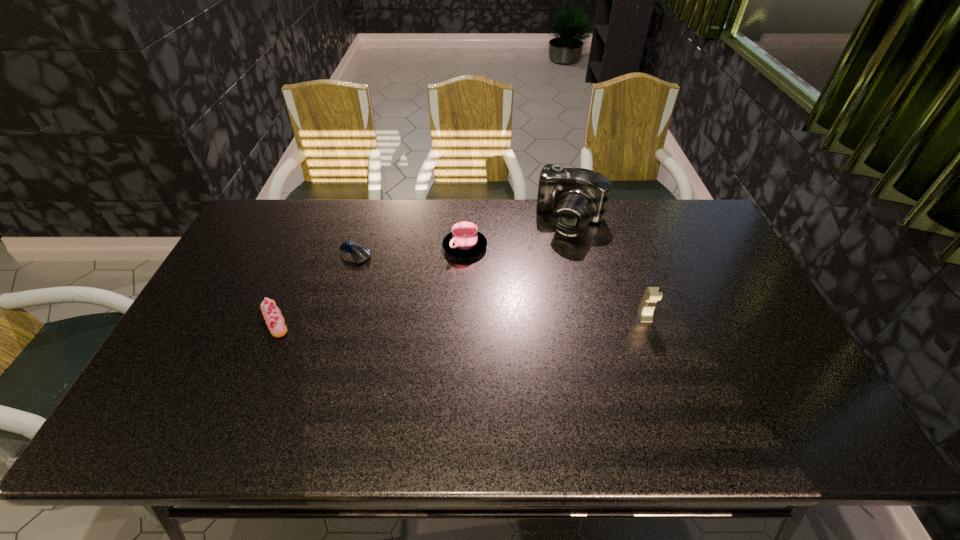
The image size is (960, 540). What are the coordinates of `the fourth tallest object` in the screenshot? It's located at (275, 321).

This screenshot has width=960, height=540. I want to click on eclair, so click(275, 321).

Where is `the rightmost object`? Image resolution: width=960 pixels, height=540 pixels. the rightmost object is located at coordinates (652, 294).

Locate an element on the screen. The image size is (960, 540). cup is located at coordinates (464, 241).

Identify the location of the third object from right to left. The width and height of the screenshot is (960, 540). (464, 241).

Identify the location of the fourth object from left to right. Image resolution: width=960 pixels, height=540 pixels. (577, 196).

Locate an element on the screen. the shortest object is located at coordinates (349, 251).

Identify the location of computer mouse. Image resolution: width=960 pixels, height=540 pixels. (349, 251).

At what (x,y) coordinates should I click in order to perform the action: click on free space located 0.160m on the back of the eclair. Please return your answer as a coordinate pair (x, y). The width and height of the screenshot is (960, 540). Looking at the image, I should click on (299, 263).

The height and width of the screenshot is (540, 960). Identify the location of free space located on the front of the rightmost object, where the keypad is located. (671, 395).